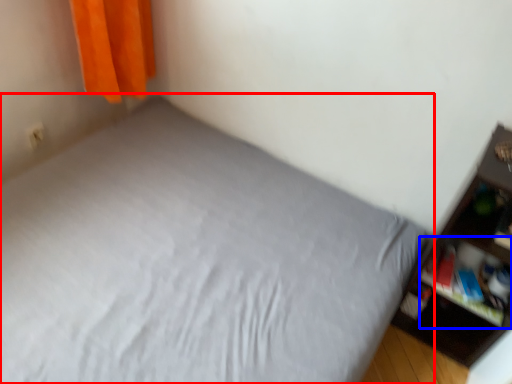
Question: Which of the following is the farthest to the observer, bed (highlighted by a red box) or cabinet (highlighted by a blue box)?

Choices:
 (A) bed
 (B) cabinet

Answer: (B)